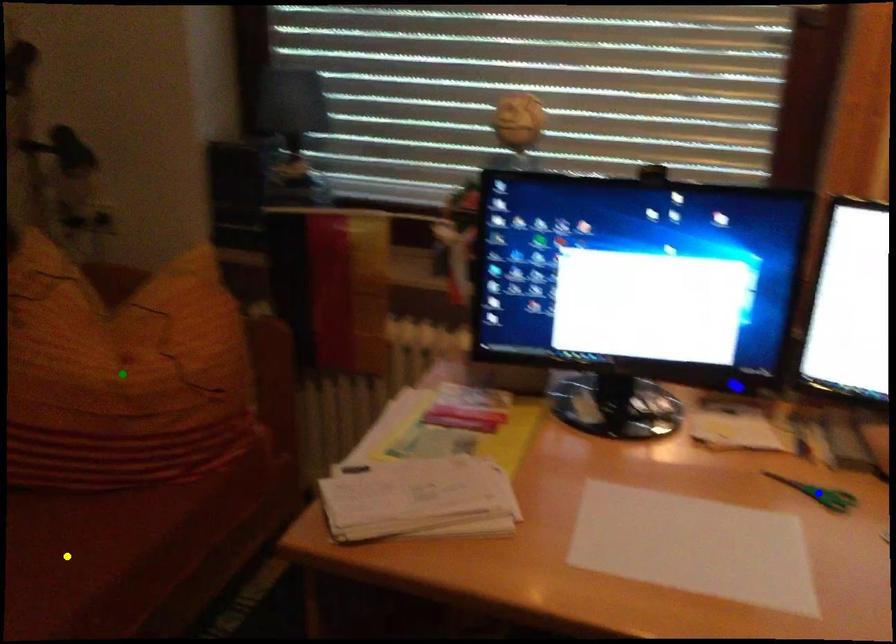
Order these from nearest to farthest:
blue point
green point
yellow point

blue point < yellow point < green point